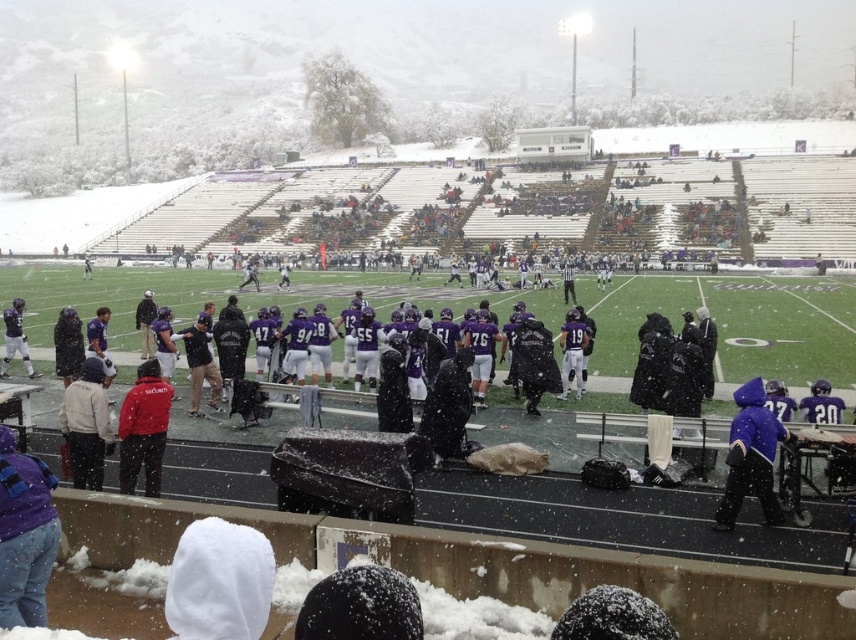
Looking at this image, you are a photographer standing at the edge of the field. You want to take a photo that includes both the purple matte jacket at lower right and the red matte jacket at center. Given that your camera has a maximum zoom range of 10 meters, will you be able to capture both jackets in the same frame without moving closer?

The purple matte jacket at lower right is 8.43 meters away from the red matte jacket at center. Since the distance between them is within the camera maximum zoom range of 10 meters, you can capture both jackets in the same frame without moving closer.

You are a photographer trying to capture a photo of the purple fleece jacket at lower left and the white fleece jacket at lower left. Based on their positions, which jacket is closer to the bottom of the image?

The purple fleece jacket at lower left is below the white fleece jacket at lower left, so it is closer to the bottom of the image.

You are a photographer at the snowy stadium and want to capture both the purple matte jacket at lower right and the black matte jacket at left in a single shot. Which jacket will appear taller in the photo?

The purple matte jacket at lower right will appear taller in the photo since it has a greater height compared to the black matte jacket at left.